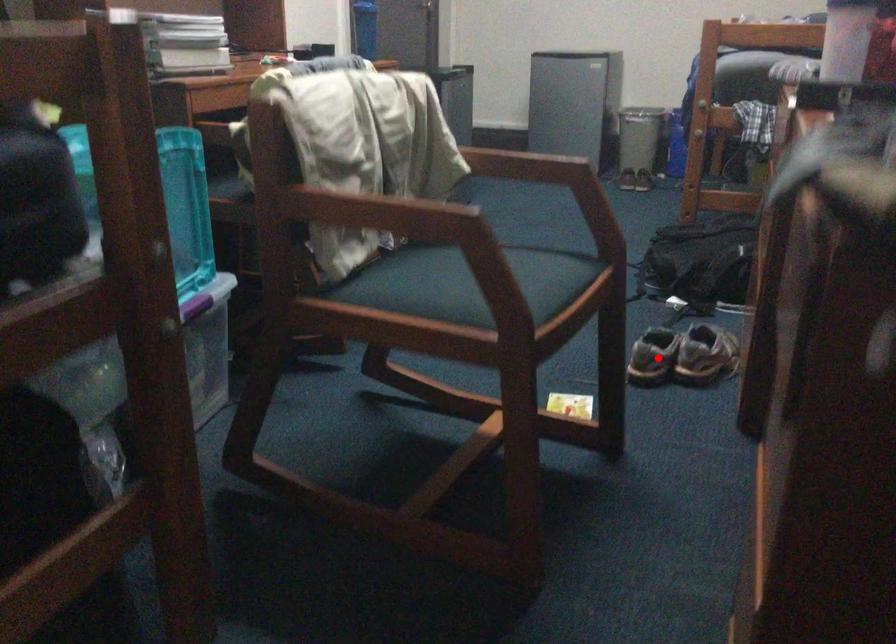
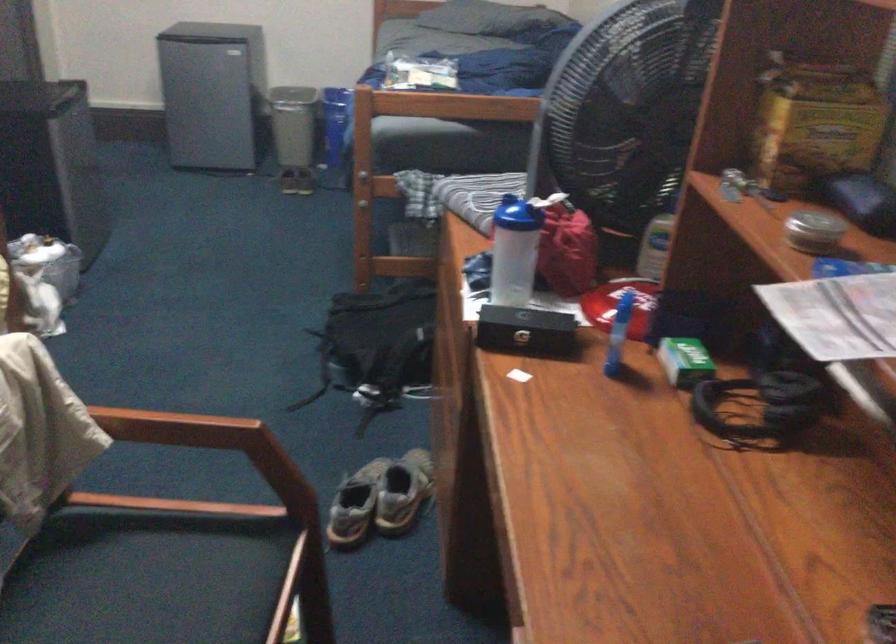
In the second image, find the point that corresponds to the highlighted location in the first image.

(355, 505)